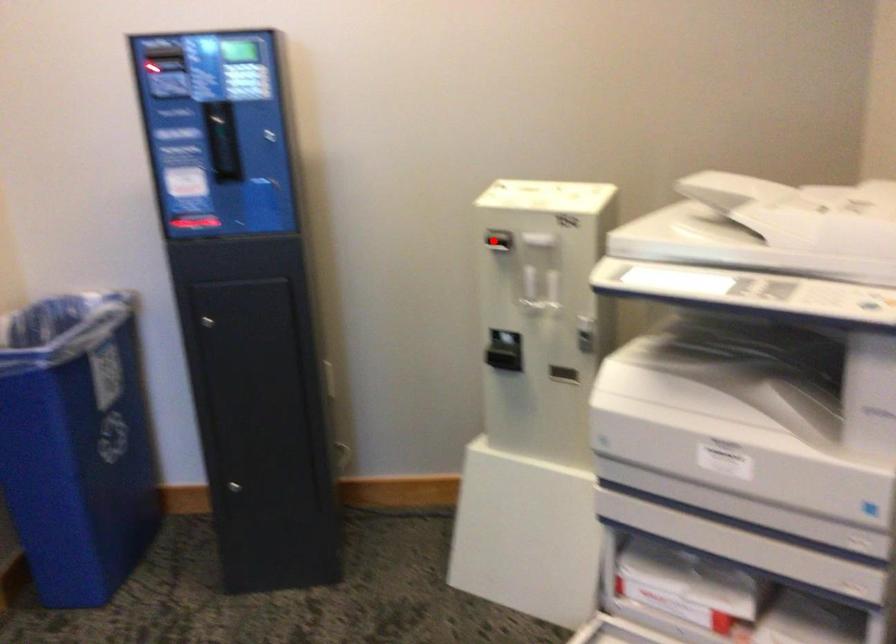
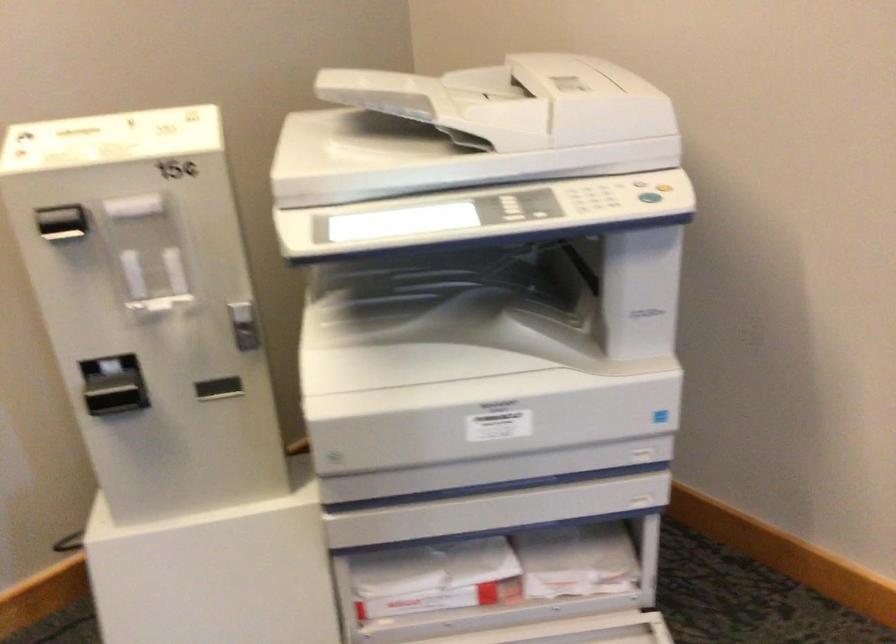
Question: I am providing you with two images of the same scene from different viewpoints. A red point is shown in image1. For the corresponding object point in image2, is it positioned nearer or farther from the camera?

Choices:
 (A) Nearer
 (B) Farther

Answer: (A)